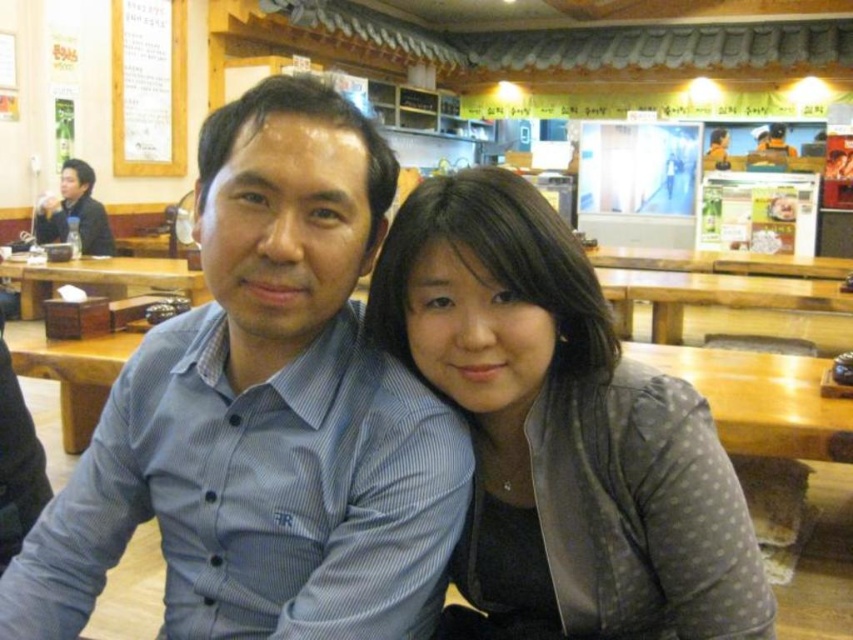
Is wooden table at center shorter than matte black jacket at upper left?

Yes, wooden table at center is shorter than matte black jacket at upper left.

From the picture: Between wooden table at center and matte black jacket at upper left, which one has less height?

Standing shorter between the two is wooden table at center.

Is point (103, 273) farther from camera compared to point (49, 236)?

No, (103, 273) is in front of (49, 236).

The image size is (853, 640). What are the coordinates of `wooden table at center` in the screenshot? It's located at (102, 278).

Based on the photo, who is positioned more to the left, gray dotted jacket at center or matte black jacket at upper left?

From the viewer's perspective, matte black jacket at upper left appears more on the left side.

Which is behind, point (706, 584) or point (59, 220)?

Point (59, 220)

Who is more forward, [718,524] or [59,208]?

Point [718,524] is more forward.

Where is `gray dotted jacket at center`? The width and height of the screenshot is (853, 640). gray dotted jacket at center is located at coordinates (561, 432).

Which of these two, blue striped shirt at center or matte black jacket at upper left, stands shorter?

blue striped shirt at center

Which is above, blue striped shirt at center or matte black jacket at upper left?

matte black jacket at upper left

Is point (349, 362) positioned behind point (105, 232)?

That is False.

You are a GUI agent. You are given a task and a screenshot of the screen. Output one action in this format:
    pyautogui.click(x=<x>, y=<y>)
    Task: Click on the blue striped shirt at center
    This screenshot has height=640, width=853.
    Given the screenshot: What is the action you would take?
    pyautogui.click(x=265, y=413)